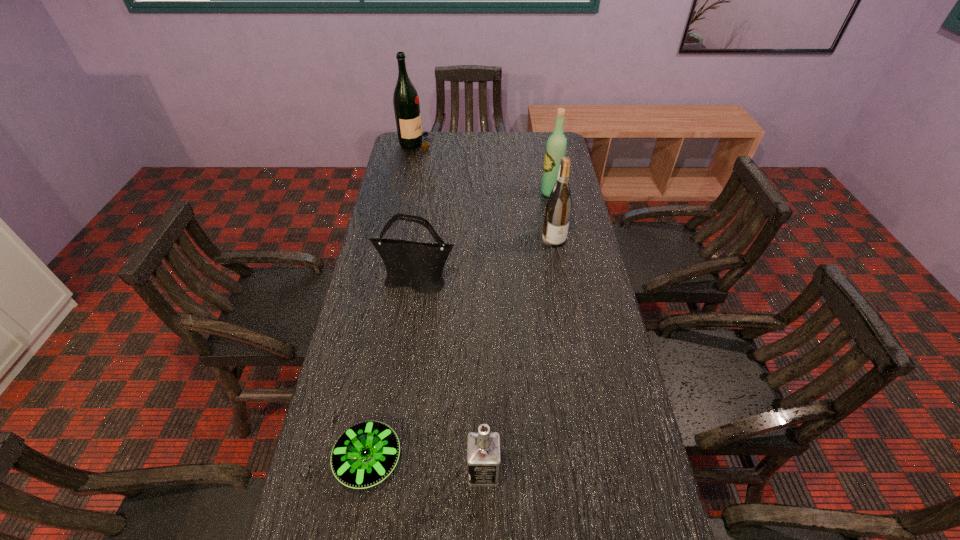
Find the location of a particular element. This screenshot has width=960, height=540. free point between the vodka and the farthest object is located at coordinates (450, 308).

Where is `empty space between the saucer and the fourth tallest object`? This screenshot has height=540, width=960. empty space between the saucer and the fourth tallest object is located at coordinates (x=393, y=372).

You are a GUI agent. You are given a task and a screenshot of the screen. Output one action in this format:
    pyautogui.click(x=<x>, y=<y>)
    Task: Click on the free space that is in between the farthest wine bottle and the third farthest object
    This screenshot has width=960, height=540.
    Given the screenshot: What is the action you would take?
    pyautogui.click(x=486, y=192)

At what (x,y) coordinates should I click in order to perform the action: click on blank region between the fifth tallest object and the fourth farthest object. Please return your answer as a coordinate pair (x, y). The image size is (960, 540). Looking at the image, I should click on pyautogui.click(x=450, y=378).

Where is `vacant area that lies between the nearest wine bottle and the farthest object`? The image size is (960, 540). vacant area that lies between the nearest wine bottle and the farthest object is located at coordinates (486, 192).

At what (x,y) coordinates should I click in order to perform the action: click on unoccupied area between the nearest wine bottle and the second shortest object. Please return your answer as a coordinate pair (x, y). Image resolution: width=960 pixels, height=540 pixels. Looking at the image, I should click on (518, 355).

Where is `object that is the nearest to the fourth object from left to right`? The width and height of the screenshot is (960, 540). object that is the nearest to the fourth object from left to right is located at coordinates (364, 455).

Find the location of a particular element. The image size is (960, 540). object that is the second closest to the shortest object is located at coordinates (419, 266).

This screenshot has width=960, height=540. What are the coordinates of `wine bottle object that ranks as the second closest to the nearest wine bottle` in the screenshot? It's located at (405, 99).

Point out which wine bottle is positioned as the third nearest to the second shortest object. Please provide its 2D coordinates. Your answer should be formatted as a tuple, i.e. [(x, y)], where the tuple contains the x and y coordinates of a point satisfying the conditions above.

[(405, 99)]